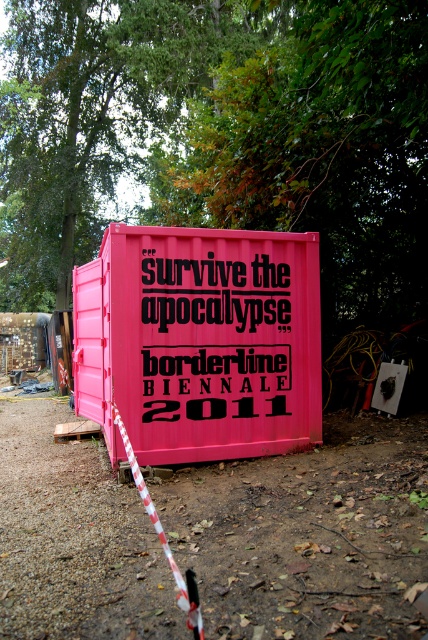
Between pink plastic shipping container at center and blackmaterial/texturetext at center, which one is positioned lower?

pink plastic shipping container at center is below.

Can you confirm if pink plastic shipping container at center is shorter than blackmaterial/texturetext at center?

Incorrect, pink plastic shipping container at center's height does not fall short of blackmaterial/texturetext at center's.

Is point (288, 381) in front of point (162, 369)?

No, it is not.

I want to click on pink plastic shipping container at center, so click(199, 340).